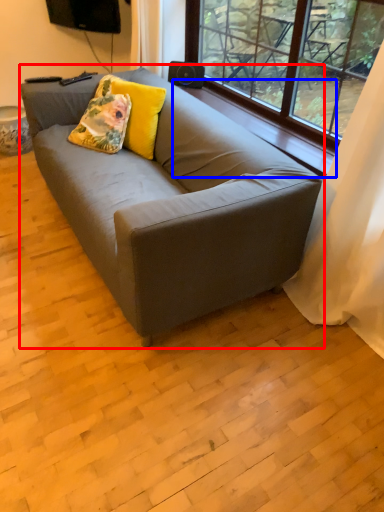
Question: Which point is closer to the camera, studio couch (highlighted by a red box) or window sill (highlighted by a blue box)?

Choices:
 (A) studio couch
 (B) window sill

Answer: (A)